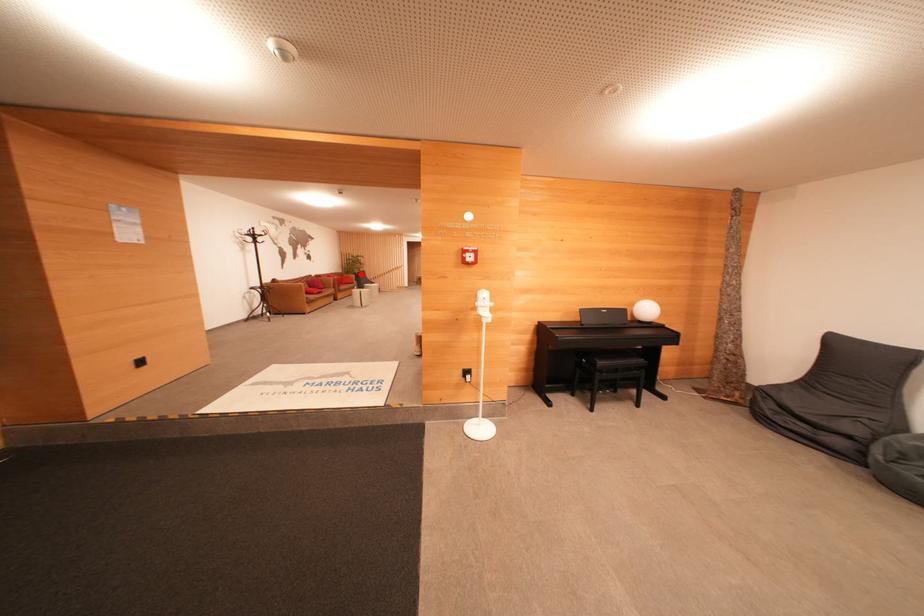
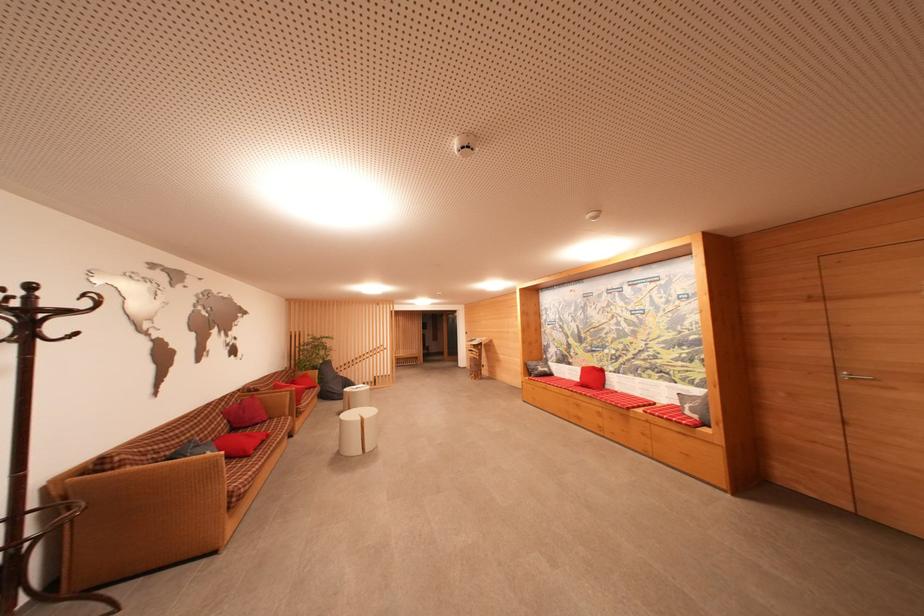
Question: A red point is marked in image1. In image2, is the corresponding 3D point closer to the camera or farther? Reply with the corresponding letter.

Choices:
 (A) The corresponding 3D point is closer.
 (B) The corresponding 3D point is farther.

Answer: (B)